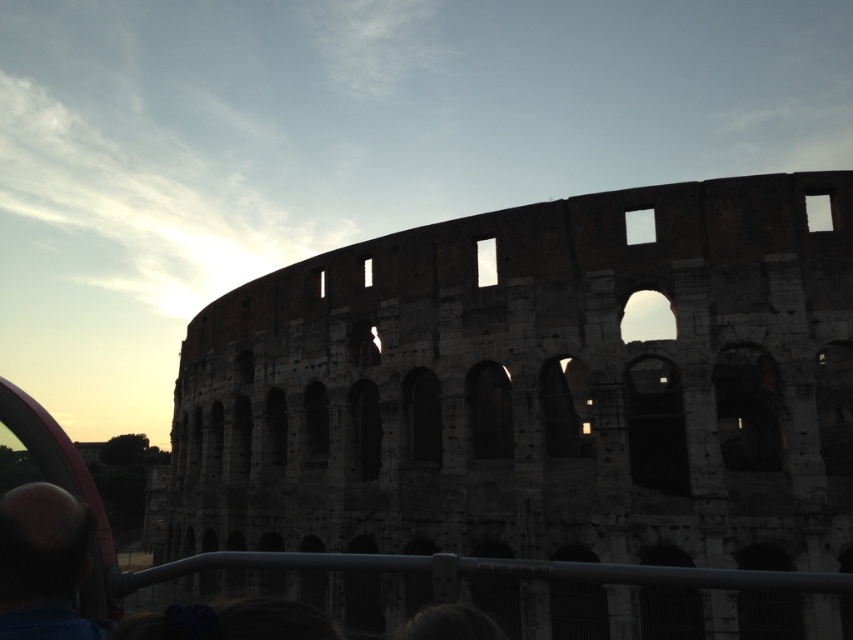
Question: Can you confirm if brown stone amphitheater at center is positioned to the right of smooth bald head at lower left?

Choices:
 (A) yes
 (B) no

Answer: (A)

Question: Does brown stone amphitheater at center appear on the right side of smooth bald head at lower left?

Choices:
 (A) no
 (B) yes

Answer: (B)

Question: Which point is closer to the camera taking this photo?

Choices:
 (A) (79, 529)
 (B) (387, 365)

Answer: (A)

Question: Does brown stone amphitheater at center appear under smooth bald head at lower left?

Choices:
 (A) no
 (B) yes

Answer: (A)